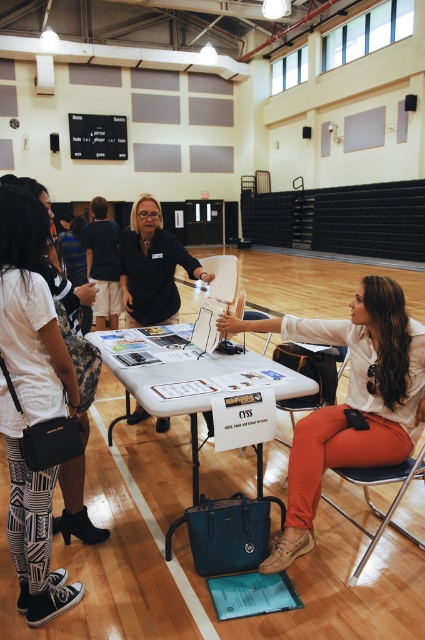
Question: Can you confirm if white matte shirt at center is positioned above matte black shirt at center?

Choices:
 (A) no
 (B) yes

Answer: (A)

Question: Which of these objects is positioned farthest from the white printed leggings at lower left?

Choices:
 (A) metallic silver chair at lower center
 (B) white matte shirt at center
 (C) matte black shirt at center

Answer: (C)

Question: Does white printed leggings at lower left have a greater width compared to white plastic table at center?

Choices:
 (A) no
 (B) yes

Answer: (A)

Question: Which of the following is the closest to the observer?

Choices:
 (A) white printed leggings at lower left
 (B) white plastic table at center

Answer: (A)

Question: Can you confirm if white plastic table at center is smaller than matte black shirt at center?

Choices:
 (A) no
 (B) yes

Answer: (A)

Question: Which point is farther to the camera?

Choices:
 (A) (306, 538)
 (B) (342, 512)

Answer: (B)